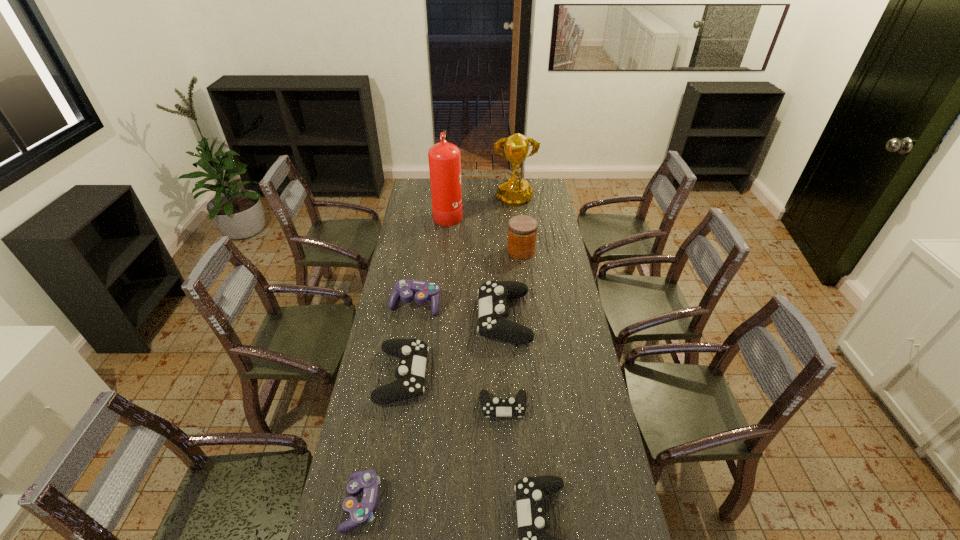
Find the location of `the smaller purple control`. the smaller purple control is located at coordinates (367, 481).

Identify the location of the shortest control. (495, 407).

I want to click on the shortest object, so click(495, 407).

Identify the location of free space located 0.390m towards the nozzle of the red fire extinguisher. (535, 213).

Find the location of a particular element. vacant space located on the front side of the second tallest object is located at coordinates (520, 253).

Identify the location of free region located on the front of the jar. (524, 278).

Identify the location of free location located on the surface of the biggest black control. (386, 318).

I want to click on blank space located 0.290m on the surface of the biggest black control, so click(x=407, y=318).

The image size is (960, 540). Find the location of `vacant position located 0.270m on the surface of the biggest black control`. vacant position located 0.270m on the surface of the biggest black control is located at coordinates (412, 318).

In order to click on vacant space located on the back of the farther purple control in this screenshot , I will do `click(420, 275)`.